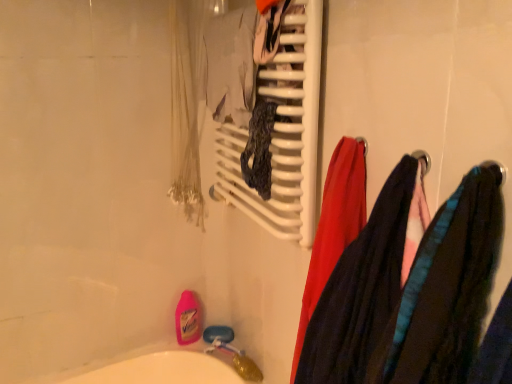
Question: Can you confirm if white plastic towel rack at upper center is thinner than velvet-like fabric at right, the 1th clothing positioned from the back?

Choices:
 (A) yes
 (B) no

Answer: (A)

Question: Does white plastic towel rack at upper center turn towards velvet-like fabric at right, the 2th clothing in the front-to-back sequence?

Choices:
 (A) no
 (B) yes

Answer: (A)

Question: Is white plastic towel rack at upper center wider than velvet-like fabric at right, the 2th clothing in the front-to-back sequence?

Choices:
 (A) yes
 (B) no

Answer: (B)

Question: Is white plastic towel rack at upper center behind velvet-like fabric at right, the 2th clothing in the front-to-back sequence?

Choices:
 (A) no
 (B) yes

Answer: (B)

Question: Are white plastic towel rack at upper center and velvet-like fabric at right, the 2th clothing in the front-to-back sequence, beside each other?

Choices:
 (A) no
 (B) yes

Answer: (A)

Question: In terms of height, does velvet-like fabric at right, the 2th clothing in the front-to-back sequence, look taller or shorter compared to velvet-like fabric scarf at right, which is counted as the second clothing, starting from the back?

Choices:
 (A) short
 (B) tall

Answer: (B)

Question: Choose the correct answer: Is velvet-like fabric at right, the 1th clothing positioned from the back, inside velvet-like fabric scarf at right, the first clothing when ordered from front to back, or outside it?

Choices:
 (A) outside
 (B) inside

Answer: (A)

Question: Is velvet-like fabric at right, the 1th clothing positioned from the back, wider or thinner than velvet-like fabric scarf at right, the first clothing when ordered from front to back?

Choices:
 (A) thin
 (B) wide

Answer: (A)

Question: Considering the positions of point (339, 340) and point (468, 173), is point (339, 340) closer or farther from the camera than point (468, 173)?

Choices:
 (A) closer
 (B) farther

Answer: (B)

Question: From the image's perspective, is velvet-like fabric scarf at right, the first clothing when ordered from front to back, above or below white plastic towel rack at upper center?

Choices:
 (A) below
 (B) above

Answer: (A)

Question: Is velvet-like fabric scarf at right, which is counted as the second clothing, starting from the back, inside or outside of white plastic towel rack at upper center?

Choices:
 (A) outside
 (B) inside

Answer: (A)

Question: Relative to white plastic towel rack at upper center, is velvet-like fabric scarf at right, the first clothing when ordered from front to back, in front or behind?

Choices:
 (A) front
 (B) behind

Answer: (A)

Question: From a real-world perspective, is velvet-like fabric scarf at right, the first clothing when ordered from front to back, positioned above or below white plastic towel rack at upper center?

Choices:
 (A) below
 (B) above

Answer: (A)

Question: Based on their positions, is white plastic towel rack at upper center located to the left or right of velvet-like fabric scarf at right, which is counted as the second clothing, starting from the back?

Choices:
 (A) left
 (B) right

Answer: (A)

Question: From a real-world perspective, is white plastic towel rack at upper center physically located above or below velvet-like fabric scarf at right, which is counted as the second clothing, starting from the back?

Choices:
 (A) below
 (B) above

Answer: (B)